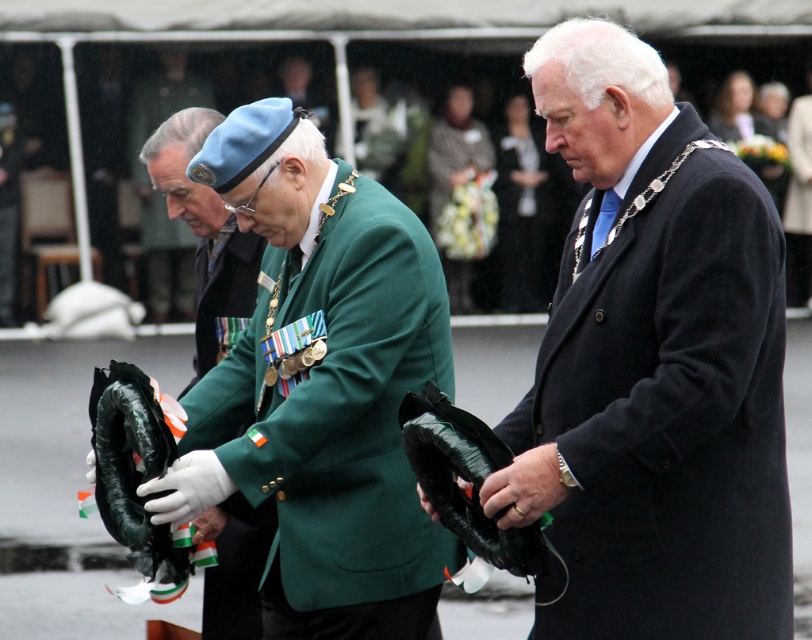
Question: Is green matte jacket at center wider than green fabric beret at center?

Choices:
 (A) no
 (B) yes

Answer: (A)

Question: Can you confirm if matte black coat at center is thinner than green fabric beret at center?

Choices:
 (A) yes
 (B) no

Answer: (A)

Question: Which point is farther to the camera?

Choices:
 (A) green matte jacket at center
 (B) matte black coat at center
 (C) green fabric beret at center

Answer: (C)

Question: Which object is farther from the camera taking this photo?

Choices:
 (A) green fabric beret at center
 (B) matte black coat at center

Answer: (A)

Question: Is green matte jacket at center bigger than green fabric beret at center?

Choices:
 (A) yes
 (B) no

Answer: (B)

Question: Based on their relative distances, which object is farther from the green fabric beret at center?

Choices:
 (A) green matte jacket at center
 (B) matte black coat at center

Answer: (B)